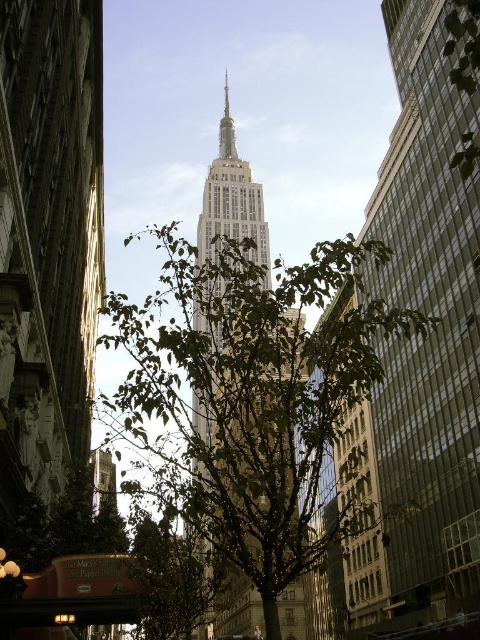
You are a photographer planning to capture the Empire State Building from this vantage point. You notice the glassy reflective skyscraper at center and the gold metallic spire at center. Which of these two objects would you need to position your camera closer to in order to avoid the tree branches in the foreground?

The glassy reflective skyscraper at center is wider than the gold metallic spire at center, so positioning the camera closer to the glassy reflective skyscraper at center would help avoid the tree branches obstructing the view.

You are a photographer planning to capture the Empire State Building. You notice the glassy reflective skyscraper at center and the gold metallic spire at center. Which object should you focus on if you want to photograph the larger one?

The glassy reflective skyscraper at center is bigger than the gold metallic spire at center, so you should focus on the glassy reflective skyscraper at center to photograph the larger one.

You are a tourist standing in front of the Empire State Building and you notice two golden elements in the scene. Which one is bigger between the gold stone tower at center and the gold metallic spire at center?

The gold stone tower at center is larger in size than the gold metallic spire at center.